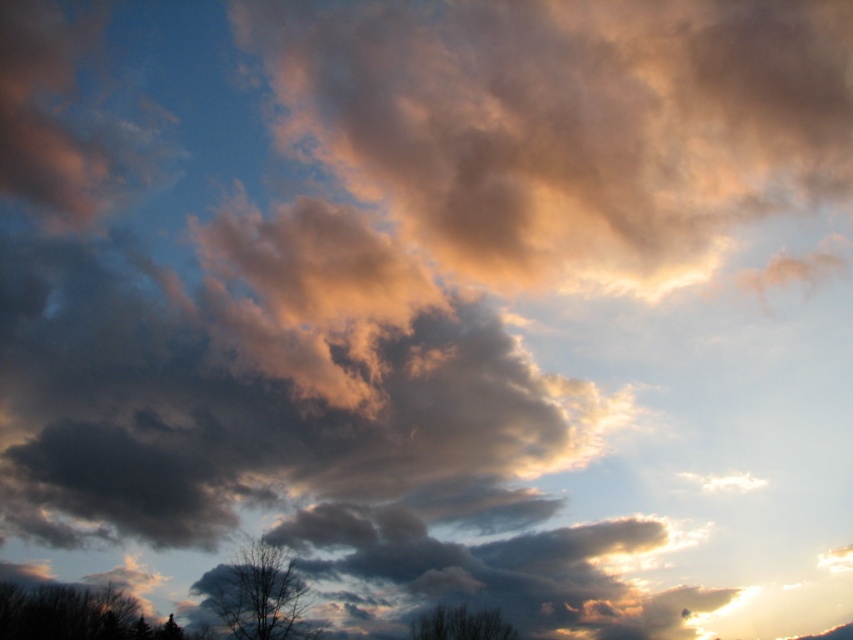
Can you confirm if dark brown textured tree at lower left is positioned below bare branches at lower center?

Incorrect, dark brown textured tree at lower left is not positioned below bare branches at lower center.

Who is more distant from viewer, (216, 586) or (447, 621)?

Positioned behind is point (447, 621).

Which is behind, point (258, 588) or point (509, 625)?

The point (509, 625) is behind.

Identify the location of dark brown textured tree at lower left. Image resolution: width=853 pixels, height=640 pixels. (257, 595).

Is golden textured cloud at upper center bigger than silhouette bare tree at lower left?

Yes.

Between point (540, 49) and point (10, 586), which one is positioned behind?

Point (540, 49)

Which is in front, point (318, 122) or point (157, 632)?

Point (157, 632)

The height and width of the screenshot is (640, 853). I want to click on golden textured cloud at upper center, so click(x=567, y=120).

Who is positioned more to the right, silhouette bare tree at lower left or bare branches at lower center?

bare branches at lower center

Does silhouette bare tree at lower left appear under bare branches at lower center?

Indeed, silhouette bare tree at lower left is positioned under bare branches at lower center.

Which is in front, point (39, 636) or point (444, 636)?

Point (444, 636) is in front.

The image size is (853, 640). In order to click on silhouette bare tree at lower left in this screenshot , I will do `click(74, 614)`.